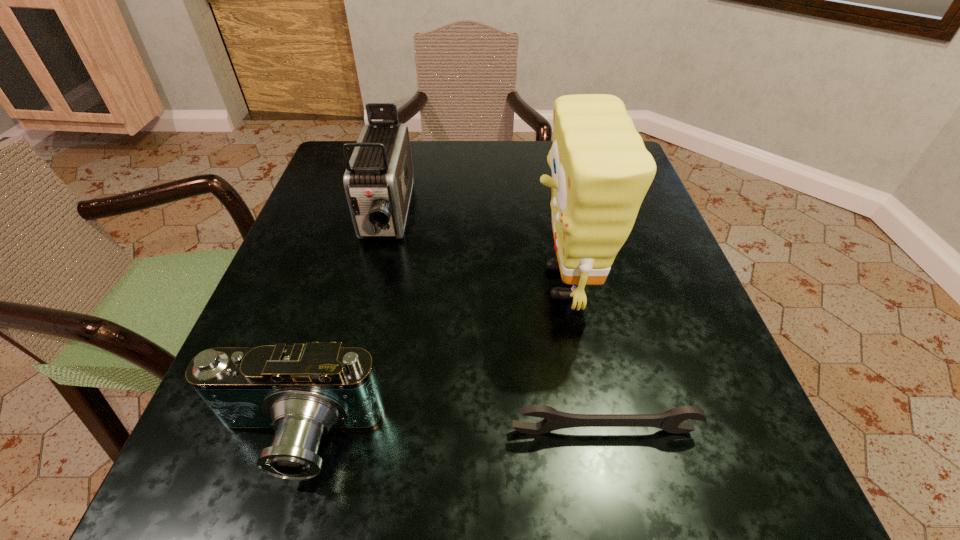
In the image, there is a desktop. Where is `vacant space at the near left corner`? The height and width of the screenshot is (540, 960). vacant space at the near left corner is located at coordinates (226, 464).

Where is `free space at the near right corner`? The width and height of the screenshot is (960, 540). free space at the near right corner is located at coordinates pyautogui.click(x=779, y=487).

Find the location of a particular element. This screenshot has height=540, width=960. free area in between the wrench and the taller camcorder is located at coordinates (495, 323).

Locate an element on the screen. This screenshot has width=960, height=540. free space that is in between the shortest object and the third shortest object is located at coordinates (495, 323).

The height and width of the screenshot is (540, 960). In order to click on free point between the wrench and the shorter camcorder in this screenshot , I will do `click(450, 435)`.

You are a GUI agent. You are given a task and a screenshot of the screen. Output one action in this format:
    pyautogui.click(x=<x>, y=<y>)
    Task: Click on the vacant space in between the second tallest object and the tallest object
    The height and width of the screenshot is (540, 960).
    Given the screenshot: What is the action you would take?
    pyautogui.click(x=475, y=249)

Locate an element on the screen. blank region between the tallest object and the second shortest object is located at coordinates (431, 361).

Locate an element on the screen. The width and height of the screenshot is (960, 540). empty space that is in between the tallest object and the taller camcorder is located at coordinates (475, 249).

Locate an element on the screen. The height and width of the screenshot is (540, 960). vacant area that lies between the sponge and the wrench is located at coordinates (584, 357).

Find the location of a particular element. free space between the shortest object and the farther camcorder is located at coordinates (495, 323).